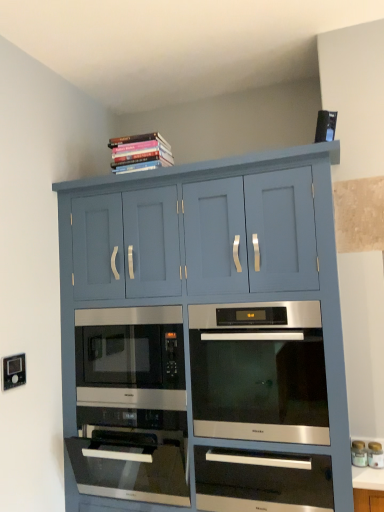
Where is `free space above white glossy countertop at lower right (from a real-world perspective)`? Image resolution: width=384 pixels, height=512 pixels. free space above white glossy countertop at lower right (from a real-world perspective) is located at coordinates pyautogui.click(x=368, y=471).